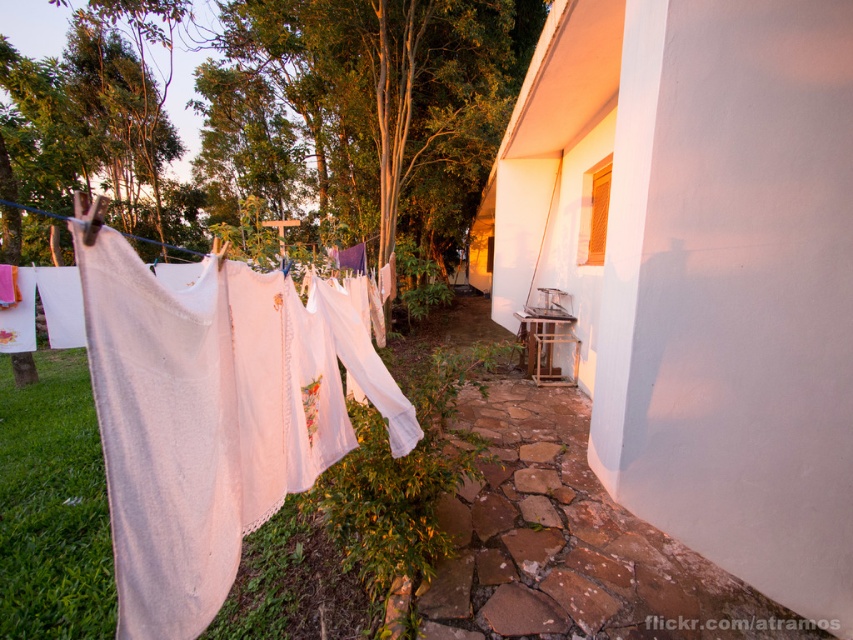
Question: In this image, where is green leafy tree at upper left located relative to white cotton laundry at left?

Choices:
 (A) right
 (B) left

Answer: (B)

Question: Which point is closer to the camera taking this photo?

Choices:
 (A) (51, 109)
 (B) (219, 362)

Answer: (B)

Question: Is green leafy tree at upper left to the right of white cotton laundry at left from the viewer's perspective?

Choices:
 (A) yes
 (B) no

Answer: (B)

Question: Is green leafy tree at upper left smaller than white cotton laundry at left?

Choices:
 (A) yes
 (B) no

Answer: (B)